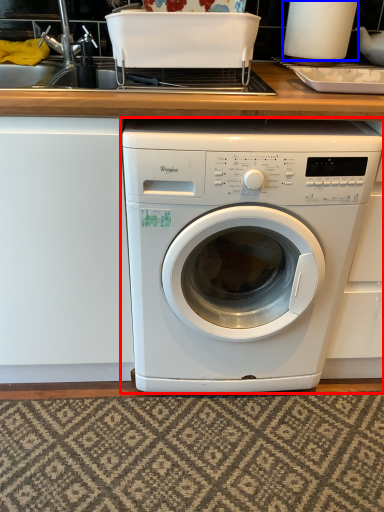
Question: Among these objects, which one is nearest to the camera, washing machine (highlighted by a red box) or appliance (highlighted by a blue box)?

Choices:
 (A) washing machine
 (B) appliance

Answer: (A)